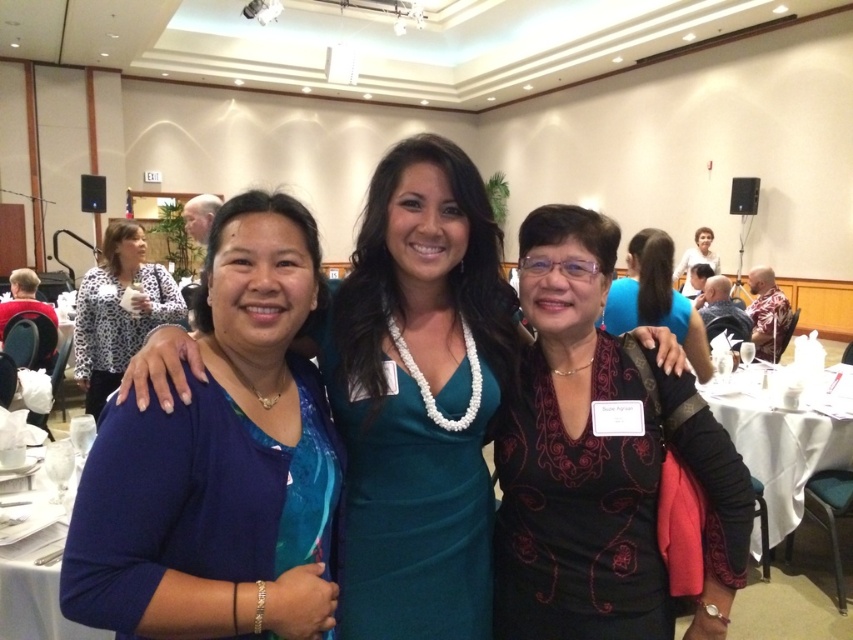
Question: Which point is closer to the camera taking this photo?

Choices:
 (A) (740, 442)
 (B) (230, 470)
 (C) (99, 365)

Answer: (B)

Question: Which is nearer to the black textured blouse at center?

Choices:
 (A) blue fabric shirt at left
 (B) matte black dress at center
 (C) white glossy table at lower left
 (D) white cloth at lower right

Answer: (A)

Question: Can you confirm if white cloth at lower right is positioned above white glossy table at lower left?

Choices:
 (A) yes
 (B) no

Answer: (A)

Question: Observing the image, what is the correct spatial positioning of blue fabric shirt at left in reference to leopard print blouse at left?

Choices:
 (A) above
 (B) below

Answer: (B)

Question: Does leopard print blouse at left appear under white glossy table at lower left?

Choices:
 (A) no
 (B) yes

Answer: (A)

Question: Estimate the real-world distances between objects in this image. Which object is closer to the white cloth at lower right?

Choices:
 (A) leopard print blouse at left
 (B) white glossy table at lower left
 (C) blue fabric shirt at left
 (D) black textured blouse at center

Answer: (D)